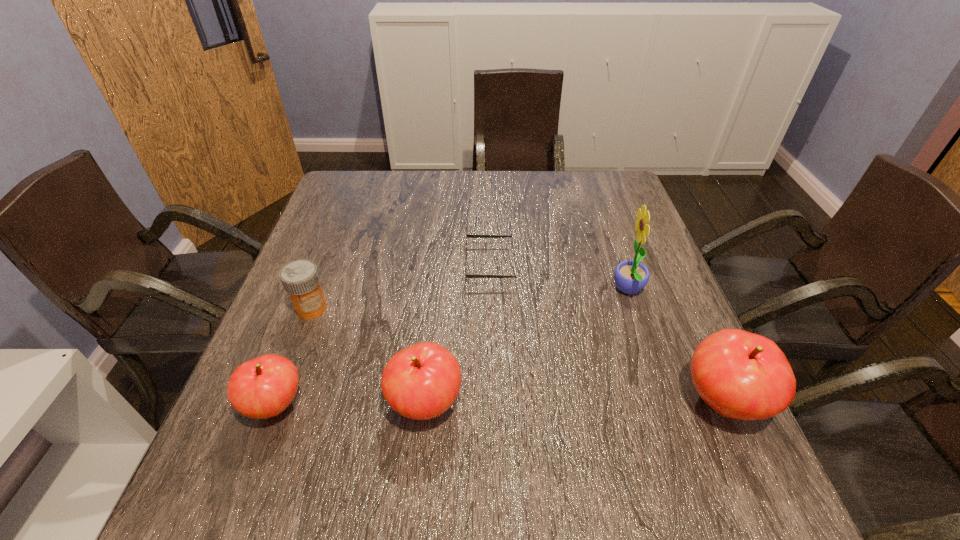
If equal spacing is desired by inserting an extra apple among them, please point out a free spot for this new apple. Please provide its 2D coordinates. Your answer should be formatted as a tuple, i.e. [(x, y)], where the tuple contains the x and y coordinates of a point satisfying the conditions above.

[(574, 402)]